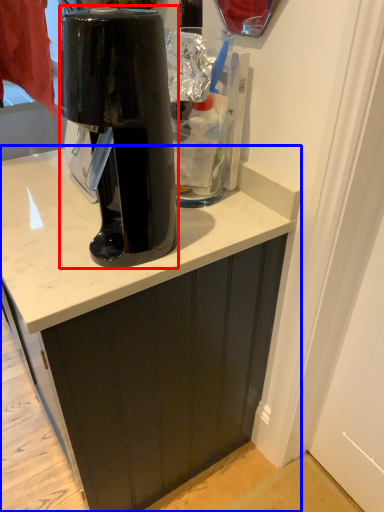
Question: Which object is further to the camera taking this photo, home appliance (highlighted by a red box) or cabinetry (highlighted by a blue box)?

Choices:
 (A) home appliance
 (B) cabinetry

Answer: (B)